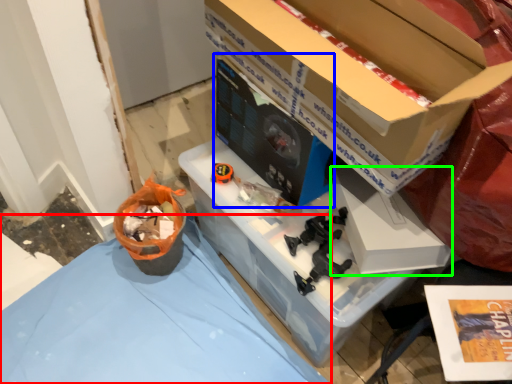
Question: Which object is positioned closest to tablecloth (highlighted by a red box)? Select from desktop computer (highlighted by a blue box) and box (highlighted by a green box).

Choices:
 (A) desktop computer
 (B) box

Answer: (A)